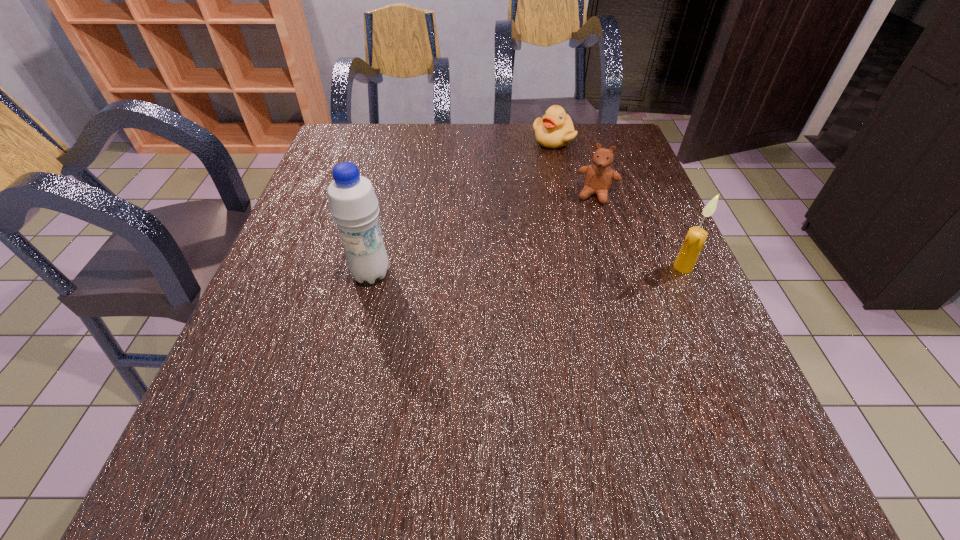
The width and height of the screenshot is (960, 540). In order to click on vacant space on the desktop that is between the tallest object and the third shortest object and is positioned on the face of the second shortest object in this screenshot , I will do `click(573, 269)`.

Identify the location of vacant spot on the desktop that is between the tallest object and the candle and is positioned on the beak of the farthest object. (536, 270).